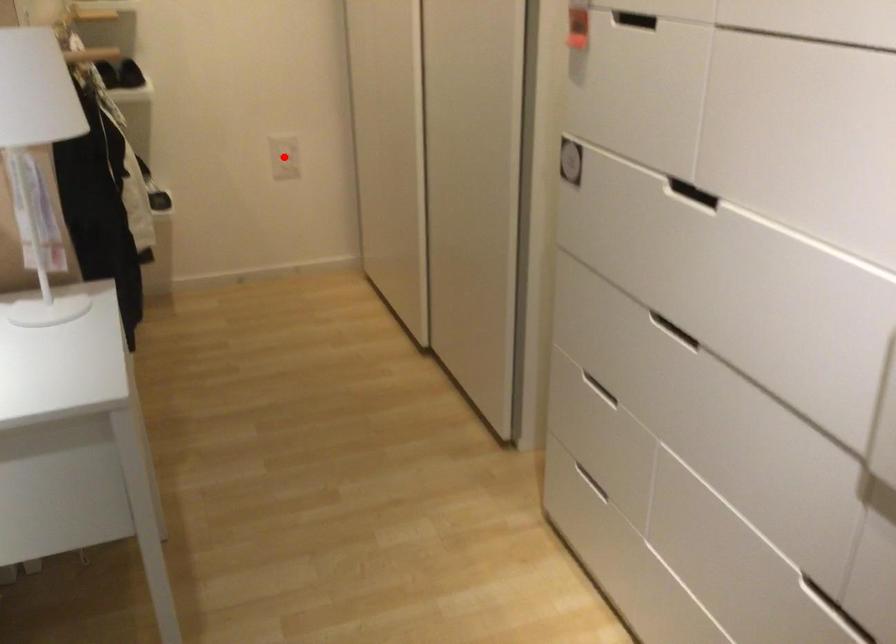
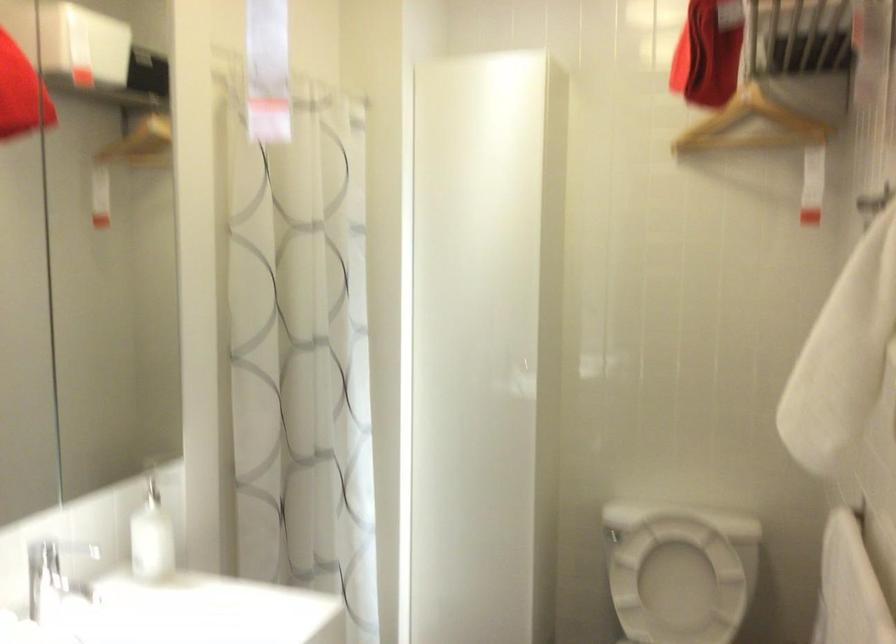
Question: I am providing you with two images of the same scene from different viewpoints. A red point is marked on the first image. At the location where the point appears in image 1, is it still visible in image 2?

Choices:
 (A) Yes
 (B) No

Answer: (B)